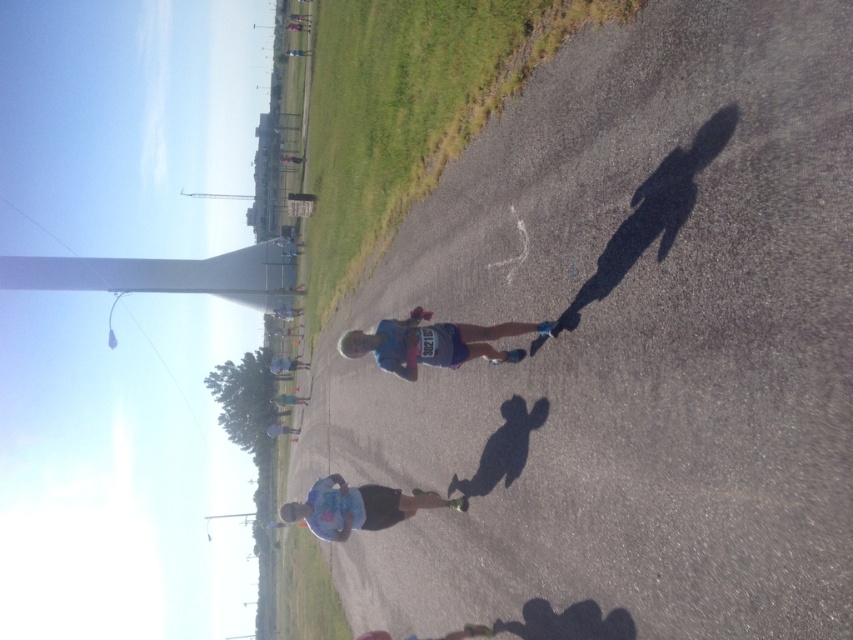
Which is more to the left, blue fabric skateboard at center or light blue fabric skateboard at center?

Positioned to the left is light blue fabric skateboard at center.

Which of these two, blue fabric skateboard at center or light blue fabric skateboard at center, stands shorter?

light blue fabric skateboard at center

Is point (490, 358) positioned before point (405, 512)?

That is True.

Identify the location of blue fabric skateboard at center. (434, 342).